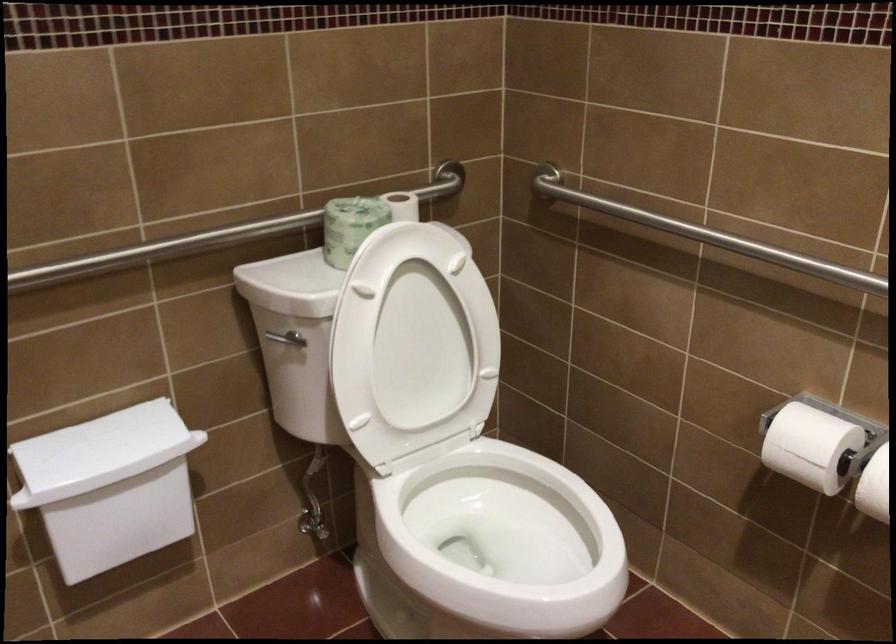
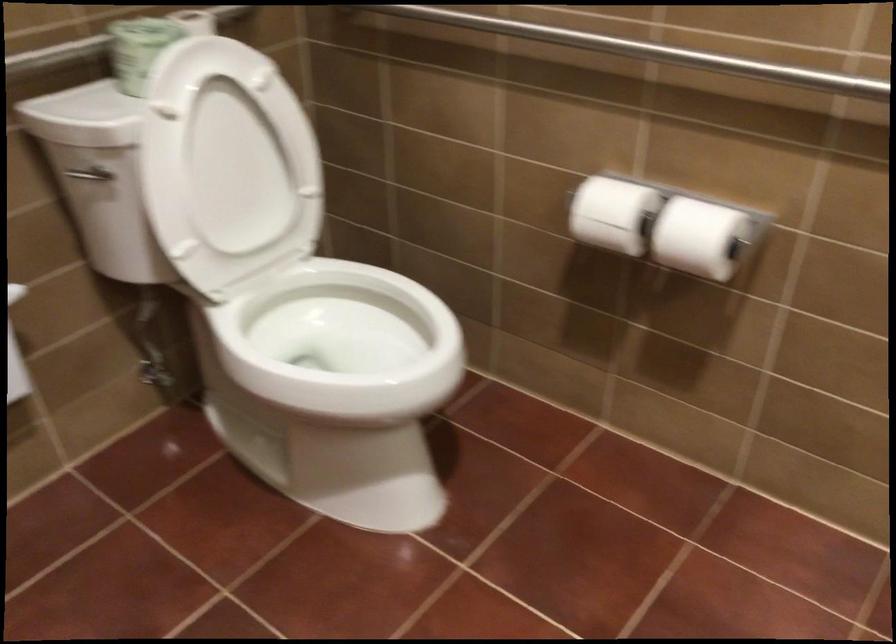
Question: What movement of the cameraman would produce the second image?

Choices:
 (A) Left
 (B) Right
 (C) Forward
 (D) Backward

Answer: (D)